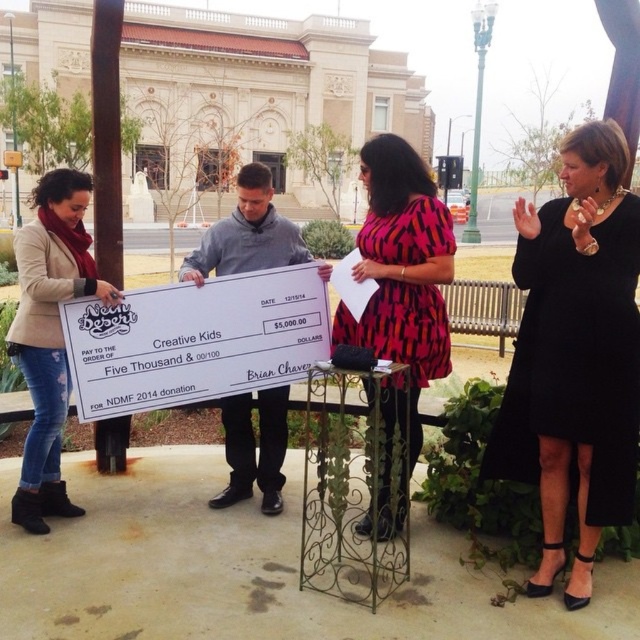
Question: Is pink printed dress at center positioned at the back of gray fabric shirt at center?

Choices:
 (A) yes
 (B) no

Answer: (B)

Question: Based on their relative distances, which object is nearer to the matte beige blazer at left?

Choices:
 (A) gray fabric shirt at center
 (B) pink printed dress at center

Answer: (A)

Question: Among these objects, which one is nearest to the camera?

Choices:
 (A) black satin dress at center
 (B) gray fabric shirt at center
 (C) pink printed dress at center

Answer: (A)

Question: Is pink printed dress at center positioned at the back of gray fabric shirt at center?

Choices:
 (A) yes
 (B) no

Answer: (B)

Question: Which of the following is the farthest from the observer?

Choices:
 (A) matte beige blazer at left
 (B) pink printed dress at center

Answer: (A)

Question: Can you confirm if pink printed dress at center is smaller than gray fabric shirt at center?

Choices:
 (A) yes
 (B) no

Answer: (A)